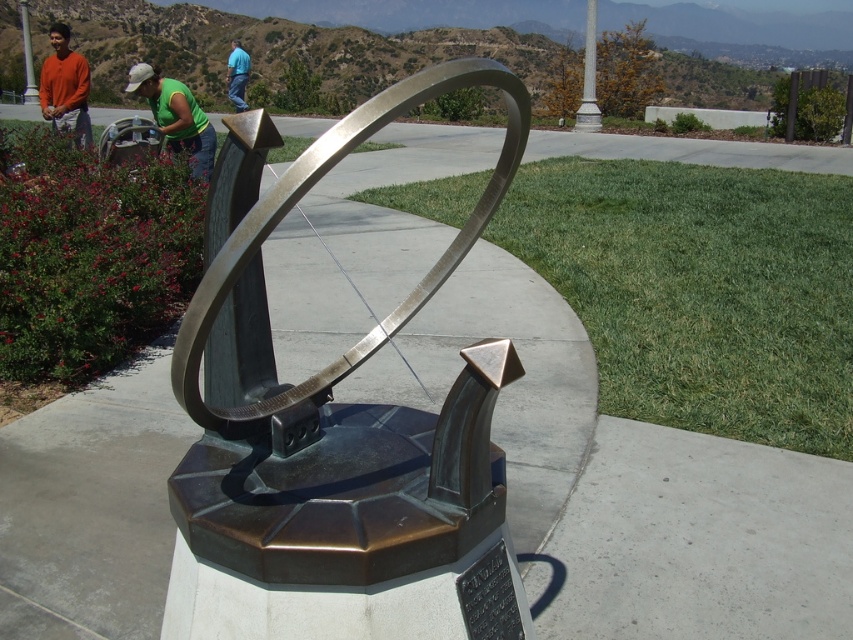
You are standing in the park and see the polished bronze sundial at center and the orange shirt at left. Which object is closer to you?

The polished bronze sundial at center is closer to you because it is in front of the orange shirt at left.

You are standing at the base of the sundial and want to greet both the person wearing the green fabric shirt at upper left and the person wearing the orange shirt at left. Which direction should you walk to reach the closer one first?

The orange shirt at left is closer to the base of the sundial than the green fabric shirt at upper left. You should walk towards the orange shirt at left first.

You are a maintenance worker who needs to reach the polished bronze sundial at center from your current position. There is a 1 meter wide path between you and the sundial. Can you walk directly to it without stepping off the path?

The distance between you and the polished bronze sundial at center is 1.02 meters. Since the path is 1 meter wide, you can walk directly to it without stepping off the path as the distance is slightly more than the path width, but the path width is sufficient for passage.